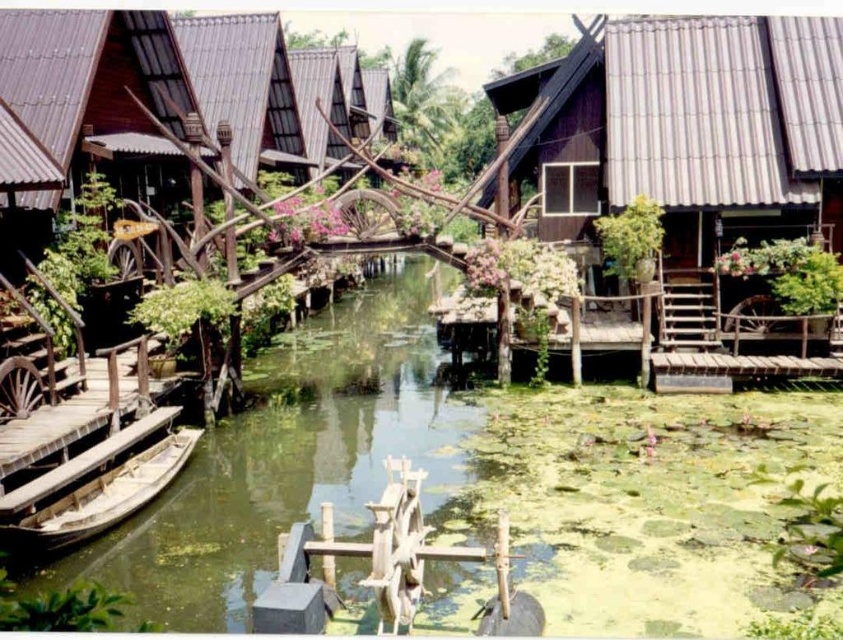
You are standing at the center of the canal and want to reach the dark brown wood hut at upper right. Which direction should you head towards?

Since the dark brown wood hut at upper right is located at point 0.202 on the x axis and 0.819 on the y axis, you should head towards the upper right direction to reach it.

You are standing at the entrance of the water village and want to take a photo of the dark brown wood hut at upper right. If your camera has a maximum zoom range of 15 meters, will you be able to capture the hut clearly without moving closer?

The dark brown wood hut at upper right is 17.00 meters away from the camera. Since the camera can only zoom up to 15 meters, you will not be able to capture the hut clearly without moving closer.